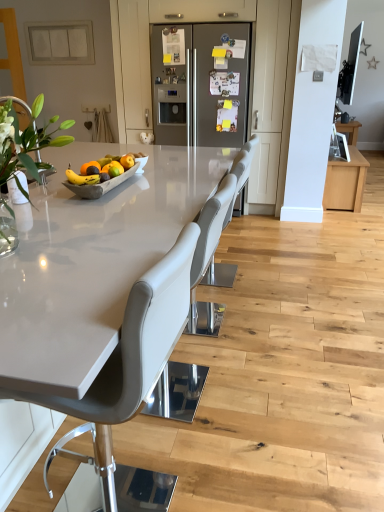
The width and height of the screenshot is (384, 512). In order to click on free spot in front of gray leather chair at center, arranged as the 1th chair when viewed from the back in this screenshot , I will do `click(241, 300)`.